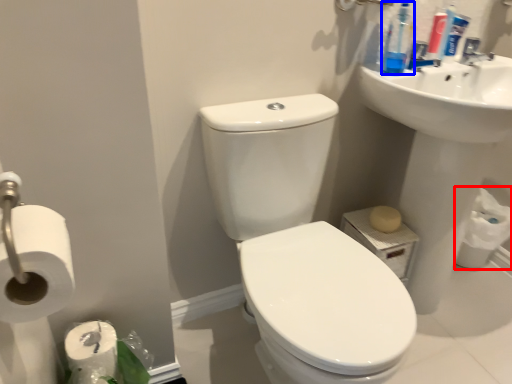
Question: Which of the following is the closest to the observer, toilet paper (highlighted by a red box) or cleaning product (highlighted by a blue box)?

Choices:
 (A) toilet paper
 (B) cleaning product

Answer: (B)